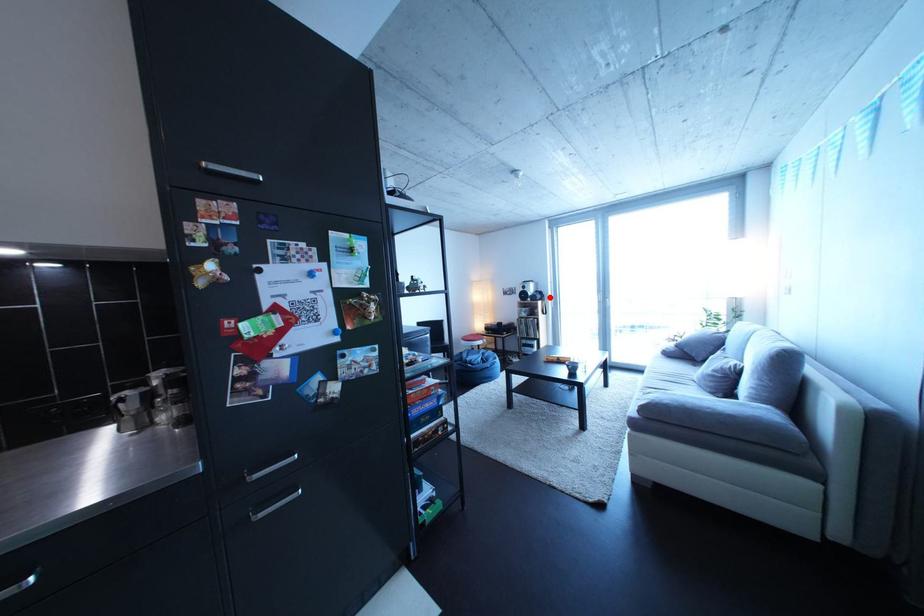
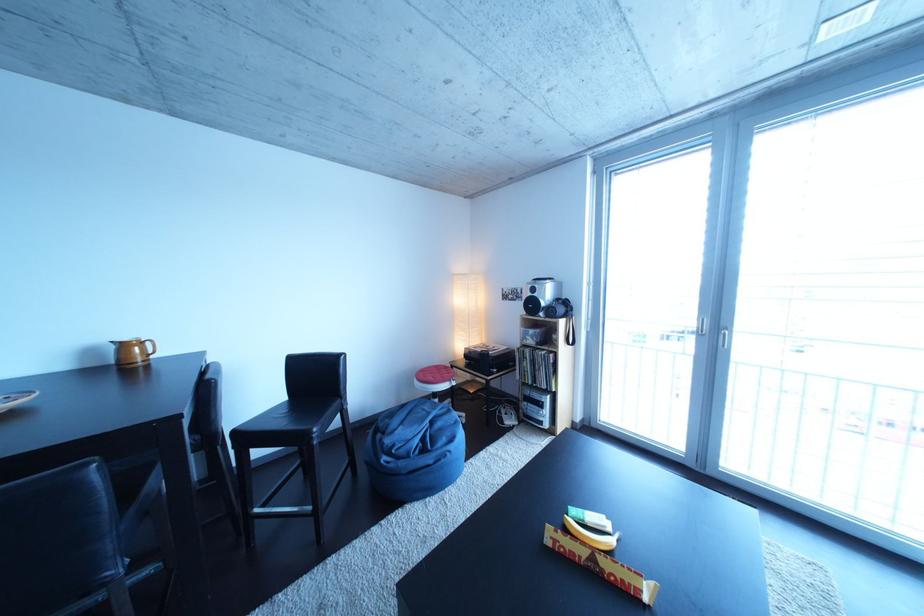
Find the pixel in the second image that matches the highlighted location in the first image.

(570, 306)